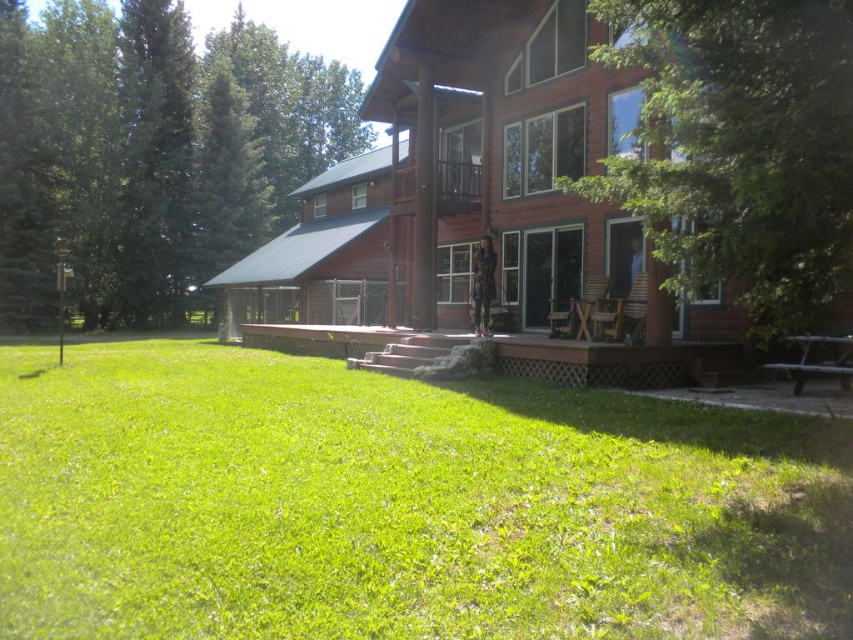
Is the position of green grass at lower left more distant than that of green leafy tree at upper right?

No.

Between green grass at lower left and green leafy tree at upper right, which one has more height?

green leafy tree at upper right is taller.

Between point (161, 618) and point (712, 216), which one is positioned in front?

Positioned in front is point (161, 618).

What are the coordinates of `green grass at lower left` in the screenshot? It's located at (401, 506).

Is brown wooden cabin at center below green leafy tree at upper left?

Yes, brown wooden cabin at center is below green leafy tree at upper left.

Which is in front, point (524, 40) or point (280, 216)?

Point (524, 40) is in front.

Does point (589, 112) lie in front of point (218, 173)?

Yes, point (589, 112) is closer to viewer.

Identify the location of brown wooden cabin at center. (457, 177).

Which is in front, point (312, 385) or point (531, 225)?

Point (312, 385) is in front.

Does green grass at lower left appear on the right side of brown wooden cabin at center?

Yes, green grass at lower left is to the right of brown wooden cabin at center.

Between point (433, 529) and point (361, 278), which one is positioned in front?

Point (433, 529) is in front.

Locate an element on the screen. green grass at lower left is located at coordinates (401, 506).